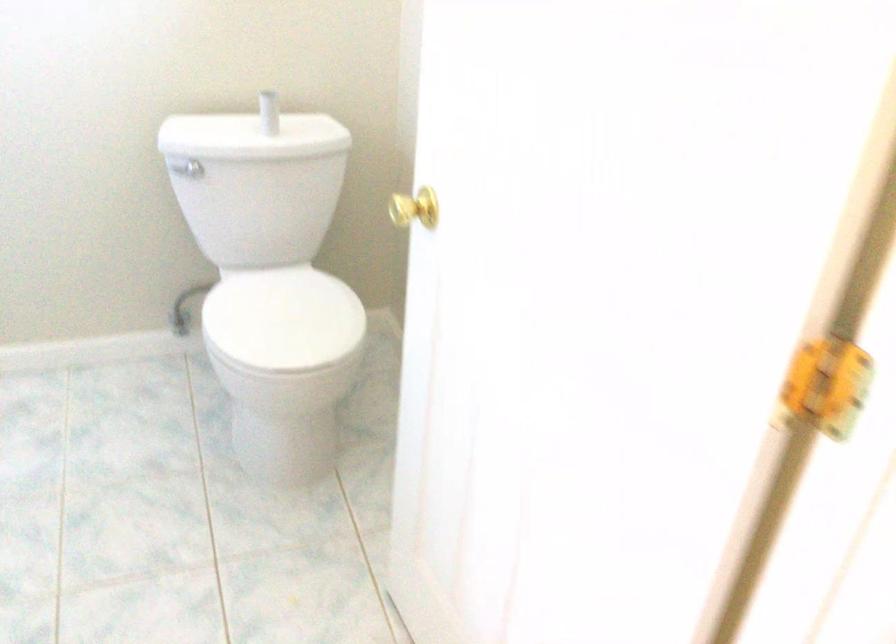
Find the location of a particular element. The height and width of the screenshot is (644, 896). white toilet tank lid is located at coordinates (251, 136).